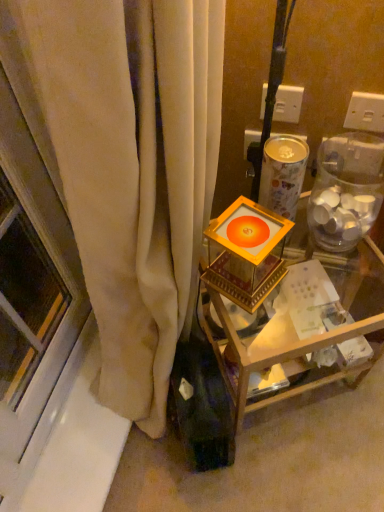
Identify the location of white plastic electric outlet at upper center, placed as the 1th electric outlet when sorted from right to left. (365, 112).

Identify the location of gold metallic frame at center. (292, 317).

Measure the distance between point (279, 116) and camera.

A distance of 37.83 inches exists between point (279, 116) and camera.

Identify the location of white plastic electric outlet at upper right, the 1th electric outlet in the left-to-right sequence. This screenshot has width=384, height=512. (288, 104).

In order to face gold metallic candle holder at center, should I rotate leftwards or rightwards?

Rotate your view right by about 7.131°.

Describe the element at coordinates (246, 253) in the screenshot. The width and height of the screenshot is (384, 512). I see `gold metallic candle holder at center` at that location.

Image resolution: width=384 pixels, height=512 pixels. Describe the element at coordinates (346, 190) in the screenshot. I see `transparent plastic jar at right` at that location.

Image resolution: width=384 pixels, height=512 pixels. In order to click on white plastic electric outlet at upper center, arranged as the second electric outlet when viewed from the left in this screenshot , I will do `click(365, 112)`.

Considering their positions, is gold metallic candle holder at center located in front of or behind white plastic electric outlet at upper center, arranged as the second electric outlet when viewed from the left?

Visually, gold metallic candle holder at center is located in front of white plastic electric outlet at upper center, arranged as the second electric outlet when viewed from the left.

Is gold metallic candle holder at center to the right of white plastic electric outlet at upper center, placed as the 1th electric outlet when sorted from right to left, from the viewer's perspective?

No, gold metallic candle holder at center is not to the right of white plastic electric outlet at upper center, placed as the 1th electric outlet when sorted from right to left.

Locate an element on the screen. This screenshot has width=384, height=512. candle holder lying in front of the white plastic electric outlet at upper center, placed as the 1th electric outlet when sorted from right to left is located at coordinates (246, 253).

Is gold metallic frame at center at the back of white plastic electric outlet at upper right, the 1th electric outlet in the left-to-right sequence?

white plastic electric outlet at upper right, the 1th electric outlet in the left-to-right sequence, does not have its back to gold metallic frame at center.

Considering the relative sizes of white plastic electric outlet at upper right, the 1th electric outlet in the left-to-right sequence, and gold metallic frame at center in the image provided, is white plastic electric outlet at upper right, the 1th electric outlet in the left-to-right sequence, shorter than gold metallic frame at center?

Yes.

Is white plastic electric outlet at upper right, placed as the 2th electric outlet when sorted from right to left, far from gold metallic frame at center?

No, there isn't a large distance between white plastic electric outlet at upper right, placed as the 2th electric outlet when sorted from right to left, and gold metallic frame at center.

Can you confirm if gold metallic frame at center is bigger than white plastic electric outlet at upper right, placed as the 2th electric outlet when sorted from right to left?

Indeed, gold metallic frame at center has a larger size compared to white plastic electric outlet at upper right, placed as the 2th electric outlet when sorted from right to left.

Considering the sizes of objects gold metallic frame at center and white plastic electric outlet at upper right, placed as the 2th electric outlet when sorted from right to left, in the image provided, who is shorter, gold metallic frame at center or white plastic electric outlet at upper right, placed as the 2th electric outlet when sorted from right to left,?

Standing shorter between the two is white plastic electric outlet at upper right, placed as the 2th electric outlet when sorted from right to left.

Would you say gold metallic frame at center is inside or outside white plastic electric outlet at upper right, placed as the 2th electric outlet when sorted from right to left?

gold metallic frame at center exists outside the volume of white plastic electric outlet at upper right, placed as the 2th electric outlet when sorted from right to left.

Measure the distance between gold metallic frame at center and gold metallic candle holder at center.

gold metallic frame at center is 5.58 inches from gold metallic candle holder at center.

Consider the image. Which of these two, gold metallic frame at center or gold metallic candle holder at center, is smaller?

gold metallic candle holder at center.

Considering the positions of objects gold metallic frame at center and gold metallic candle holder at center in the image provided, who is more to the right, gold metallic frame at center or gold metallic candle holder at center?

Positioned to the right is gold metallic frame at center.

Is gold metallic frame at center next to gold metallic candle holder at center?

There is a gap between gold metallic frame at center and gold metallic candle holder at center.

Could you tell me if transparent plastic jar at right is turned towards gold metallic candle holder at center?

No, transparent plastic jar at right is not turned towards gold metallic candle holder at center.

Would you say transparent plastic jar at right is inside or outside gold metallic candle holder at center?

transparent plastic jar at right is not inside gold metallic candle holder at center, it's outside.

From the image's perspective, which object appears higher, transparent plastic jar at right or gold metallic candle holder at center?

From the image's view, transparent plastic jar at right is above.

Can you confirm if transparent plastic jar at right is positioned to the right of gold metallic candle holder at center?

Correct, you'll find transparent plastic jar at right to the right of gold metallic candle holder at center.

Is there a large distance between white plastic electric outlet at upper right, placed as the 2th electric outlet when sorted from right to left, and transparent plastic jar at right?

No, white plastic electric outlet at upper right, placed as the 2th electric outlet when sorted from right to left, is in close proximity to transparent plastic jar at right.

Does white plastic electric outlet at upper right, placed as the 2th electric outlet when sorted from right to left, have a greater width compared to transparent plastic jar at right?

Incorrect, the width of white plastic electric outlet at upper right, placed as the 2th electric outlet when sorted from right to left, does not surpass that of transparent plastic jar at right.

Is white plastic electric outlet at upper center, placed as the 1th electric outlet when sorted from right to left, wider or thinner than gold metallic frame at center?

Considering their sizes, white plastic electric outlet at upper center, placed as the 1th electric outlet when sorted from right to left, looks slimmer than gold metallic frame at center.

Is white plastic electric outlet at upper center, arranged as the second electric outlet when viewed from the left, positioned far away from gold metallic frame at center?

white plastic electric outlet at upper center, arranged as the second electric outlet when viewed from the left, is near gold metallic frame at center, not far away.

Considering the relative positions of white plastic electric outlet at upper center, placed as the 1th electric outlet when sorted from right to left, and gold metallic frame at center in the image provided, is white plastic electric outlet at upper center, placed as the 1th electric outlet when sorted from right to left, to the right of gold metallic frame at center from the viewer's perspective?

Yes.

How far apart are white plastic electric outlet at upper center, arranged as the second electric outlet when viewed from the left, and gold metallic frame at center?

17.98 inches.

Locate an element on the screen. The image size is (384, 512). the 2nd electric outlet to the right of the gold metallic candle holder at center, counting from the anchor's position is located at coordinates (365, 112).

At what (x,y) coordinates should I click in order to perform the action: click on furniture that is below the white plastic electric outlet at upper right, placed as the 2th electric outlet when sorted from right to left (from the image's perspective). Please return your answer as a coordinate pair (x, y). The width and height of the screenshot is (384, 512). Looking at the image, I should click on (292, 317).

When comparing their distances from transparent plastic jar at right, does white plastic electric outlet at upper right, placed as the 2th electric outlet when sorted from right to left, or white plastic electric outlet at upper center, arranged as the second electric outlet when viewed from the left, seem further?

Based on the image, white plastic electric outlet at upper right, placed as the 2th electric outlet when sorted from right to left, appears to be further to transparent plastic jar at right.

Looking at this image, looking at the image, which one is located closer to gold metallic candle holder at center, white plastic electric outlet at upper center, placed as the 1th electric outlet when sorted from right to left, or gold metallic frame at center?

Based on the image, gold metallic frame at center appears to be nearer to gold metallic candle holder at center.

Based on their spatial positions, is gold metallic frame at center or transparent plastic jar at right further from white plastic electric outlet at upper center, arranged as the second electric outlet when viewed from the left?

gold metallic frame at center lies further to white plastic electric outlet at upper center, arranged as the second electric outlet when viewed from the left, than the other object.

Based on the photo, considering their positions, is white plastic electric outlet at upper right, the 1th electric outlet in the left-to-right sequence, positioned closer to white plastic electric outlet at upper center, arranged as the second electric outlet when viewed from the left, than gold metallic frame at center?

white plastic electric outlet at upper right, the 1th electric outlet in the left-to-right sequence, is closer to white plastic electric outlet at upper center, arranged as the second electric outlet when viewed from the left.

Based on their spatial positions, is white plastic electric outlet at upper right, placed as the 2th electric outlet when sorted from right to left, or gold metallic candle holder at center closer to transparent plastic jar at right?

Based on the image, gold metallic candle holder at center appears to be nearer to transparent plastic jar at right.

Which object lies nearer to the anchor point white plastic electric outlet at upper center, arranged as the second electric outlet when viewed from the left, gold metallic candle holder at center or white plastic electric outlet at upper right, the 1th electric outlet in the left-to-right sequence?

Based on the image, white plastic electric outlet at upper right, the 1th electric outlet in the left-to-right sequence, appears to be nearer to white plastic electric outlet at upper center, arranged as the second electric outlet when viewed from the left.

From the image, which object appears to be farther from gold metallic frame at center, white plastic electric outlet at upper center, arranged as the second electric outlet when viewed from the left, or gold metallic candle holder at center?

white plastic electric outlet at upper center, arranged as the second electric outlet when viewed from the left, is positioned further to the anchor gold metallic frame at center.

From the image, which object appears to be farther from gold metallic frame at center, transparent plastic jar at right or white plastic electric outlet at upper center, placed as the 1th electric outlet when sorted from right to left?

white plastic electric outlet at upper center, placed as the 1th electric outlet when sorted from right to left, is further to gold metallic frame at center.

Locate an element on the screen. glass box between white plastic electric outlet at upper right, the 1th electric outlet in the left-to-right sequence, and gold metallic frame at center vertically is located at coordinates tap(346, 190).

The height and width of the screenshot is (512, 384). In order to click on candle holder that lies between white plastic electric outlet at upper right, the 1th electric outlet in the left-to-right sequence, and gold metallic frame at center from top to bottom in this screenshot , I will do pos(246,253).

The height and width of the screenshot is (512, 384). In order to click on candle holder between transparent plastic jar at right and gold metallic frame at center vertically in this screenshot , I will do `click(246, 253)`.

Find the location of a particular element. glass box between white plastic electric outlet at upper right, placed as the 2th electric outlet when sorted from right to left, and gold metallic candle holder at center vertically is located at coordinates (346, 190).